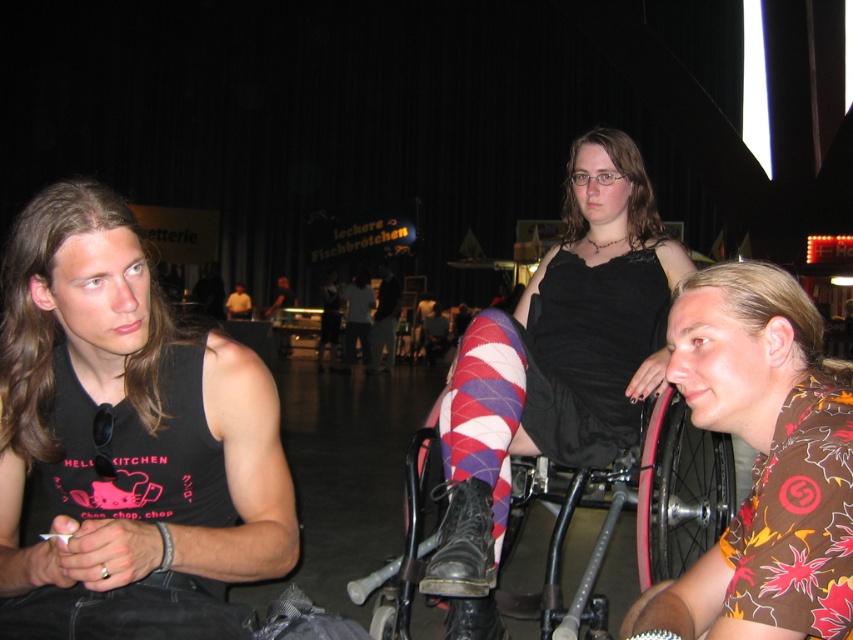
Question: Which point is farther from the camera taking this photo?

Choices:
 (A) (496, 556)
 (B) (468, 372)

Answer: (A)

Question: Does argyle wool sock at center have a greater width compared to striped tights at center?

Choices:
 (A) yes
 (B) no

Answer: (B)

Question: Among these points, which one is farthest from the camera?

Choices:
 (A) (236, 307)
 (B) (619, 429)
 (C) (19, 308)
 (D) (352, 340)

Answer: (A)

Question: Does argyle wool sock at center appear over matte black tank top at left?

Choices:
 (A) yes
 (B) no

Answer: (B)

Question: Is brown floral shirt at right smaller than striped tights at center?

Choices:
 (A) no
 (B) yes

Answer: (B)

Question: Which object is positioned closest to the matte black tank top at left?

Choices:
 (A) striped tights at center
 (B) brown floral shirt at right

Answer: (A)